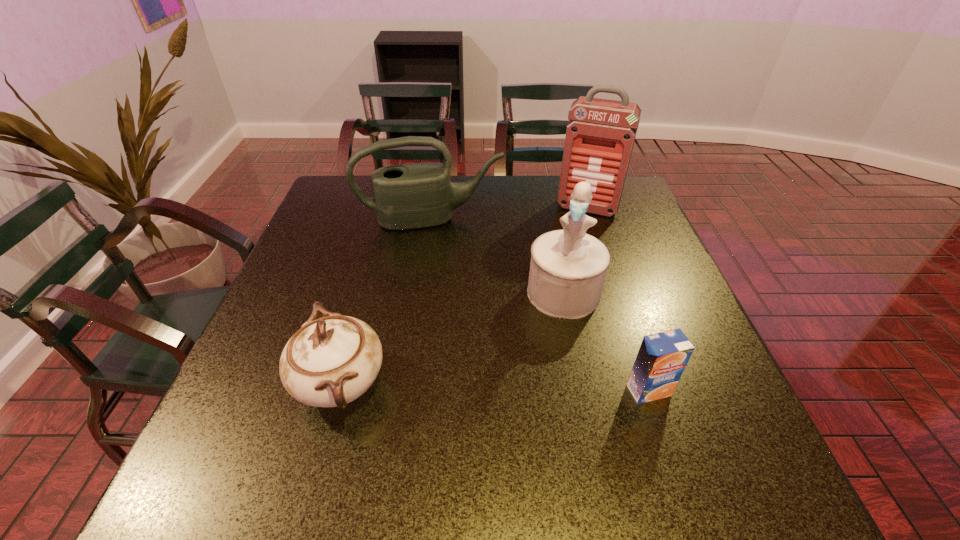
Find the location of a particular element. The height and width of the screenshot is (540, 960). free space between the shortest object and the tallest object is located at coordinates (618, 299).

Image resolution: width=960 pixels, height=540 pixels. In order to click on free space between the orange_juice and the tallest object in this screenshot , I will do `click(618, 299)`.

The image size is (960, 540). I want to click on object that is the third closest to the third nearest object, so pyautogui.click(x=600, y=135).

Where is `object that ranks as the closest to the fourth tallest object`? object that ranks as the closest to the fourth tallest object is located at coordinates (568, 267).

Locate an element on the screen. blank space that satisfies the following two spatial constraints: 1. on the front side of the shortest object; 2. on the left side of the second shortest object is located at coordinates (339, 390).